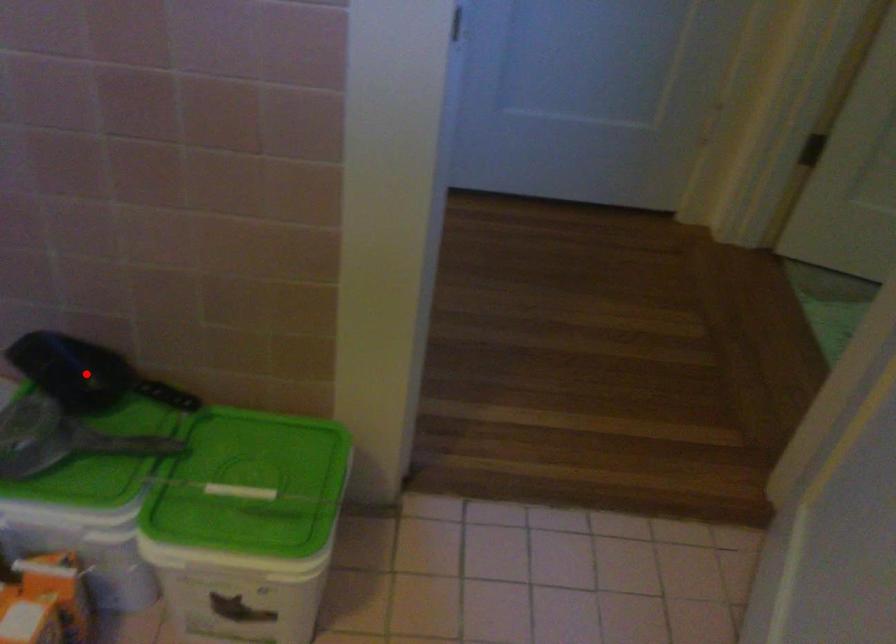
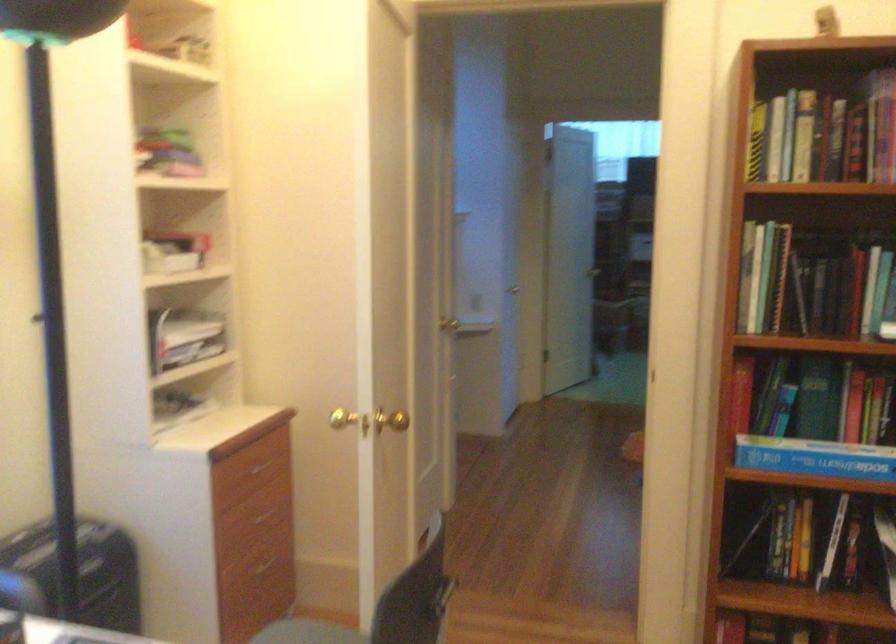
Question: I am providing you with two images of the same scene from different viewpoints. A red point is marked on the first image. Can you still see the location of the red point in image 2?

Choices:
 (A) Yes
 (B) No

Answer: (B)